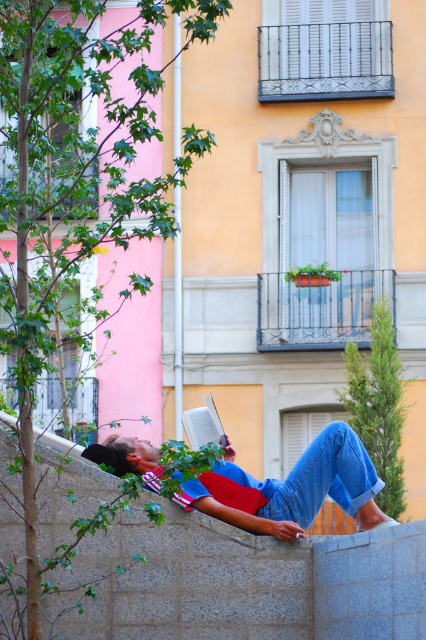
Where is `denim jeans at lower center`? The width and height of the screenshot is (426, 640). denim jeans at lower center is located at coordinates click(x=291, y=488).

Locate an element on the screen. denim jeans at lower center is located at coordinates [291, 488].

Is point (77, 508) positioned in front of point (333, 444)?

Yes, it is in front of point (333, 444).

Who is shorter, gray concrete wall at center or denim jeans at lower center?

Standing shorter between the two is denim jeans at lower center.

Locate an element on the screen. This screenshot has height=640, width=426. gray concrete wall at center is located at coordinates (247, 580).

I want to click on gray concrete wall at center, so click(x=247, y=580).

Which is above, gray concrete wall at center or blue denim jeans at lower center?

blue denim jeans at lower center is higher up.

Does gray concrete wall at center appear on the left side of blue denim jeans at lower center?

Correct, you'll find gray concrete wall at center to the left of blue denim jeans at lower center.

The width and height of the screenshot is (426, 640). In order to click on gray concrete wall at center in this screenshot , I will do `click(247, 580)`.

Find the location of a particular element. This screenshot has height=640, width=426. gray concrete wall at center is located at coordinates (247, 580).